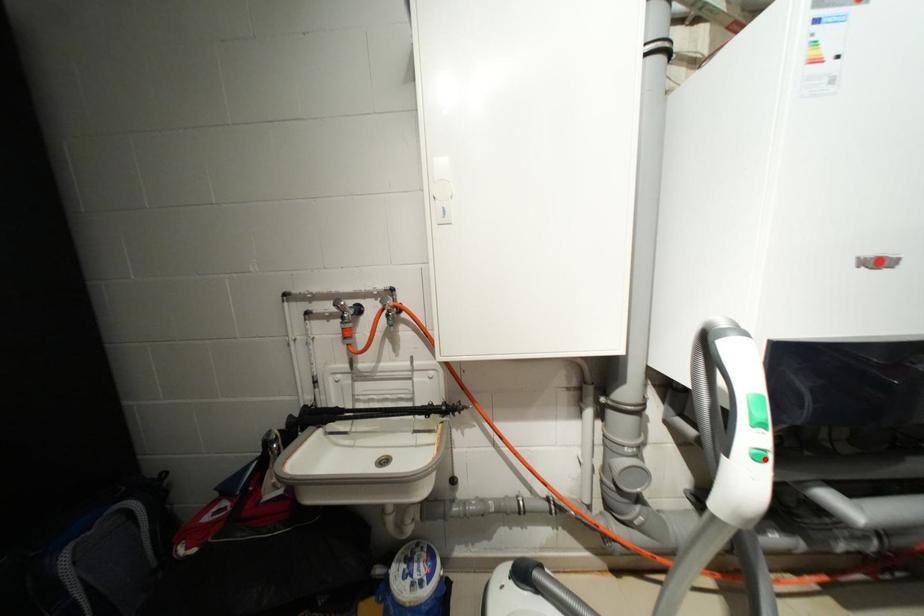
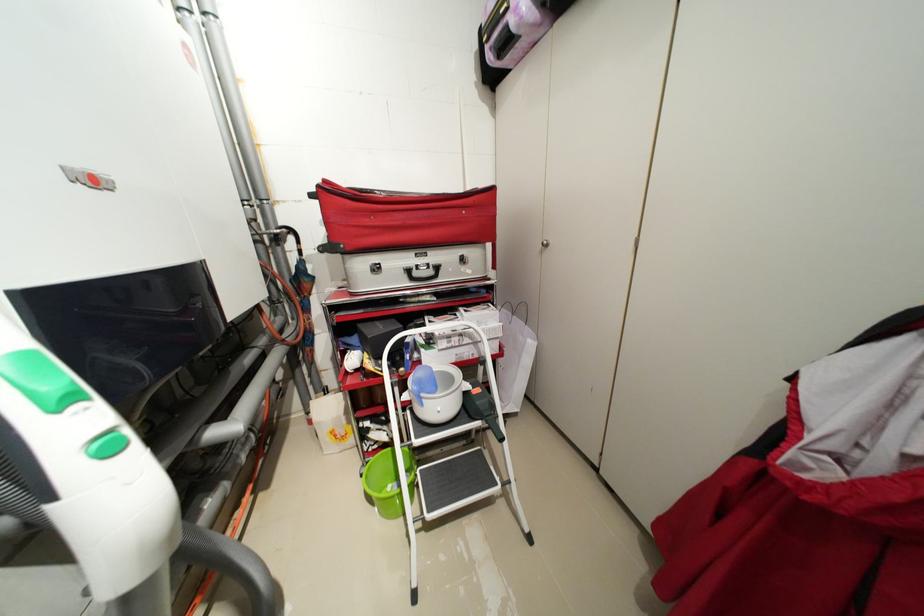
Question: I am providing you with two images of the same scene from different viewpoints. A red point is shown in image1. For the corresponding object point in image2, is it positioned nearer or farther from the camera?

Choices:
 (A) Nearer
 (B) Farther

Answer: (B)